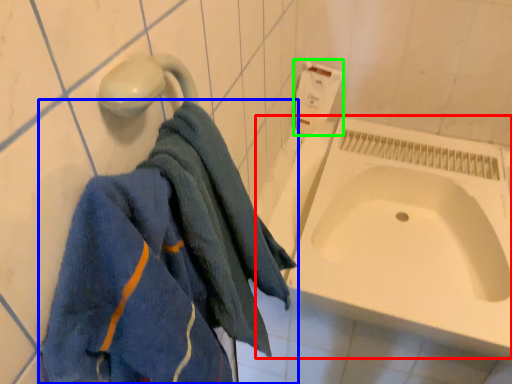
Question: Considering the real-world distances, which object is farthest from bath (highlighted by a red box)? towel (highlighted by a blue box) or toilet paper (highlighted by a green box)?

Choices:
 (A) towel
 (B) toilet paper

Answer: (A)